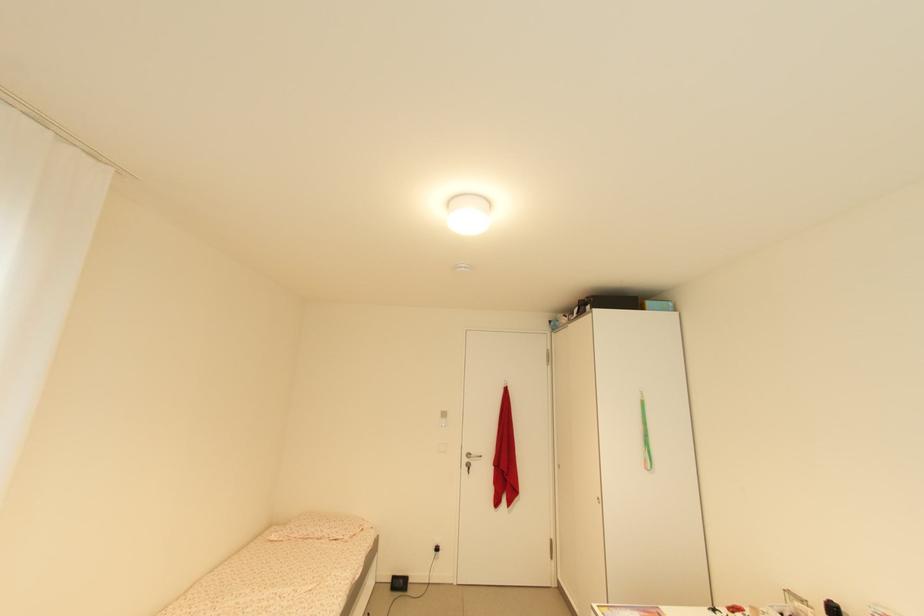
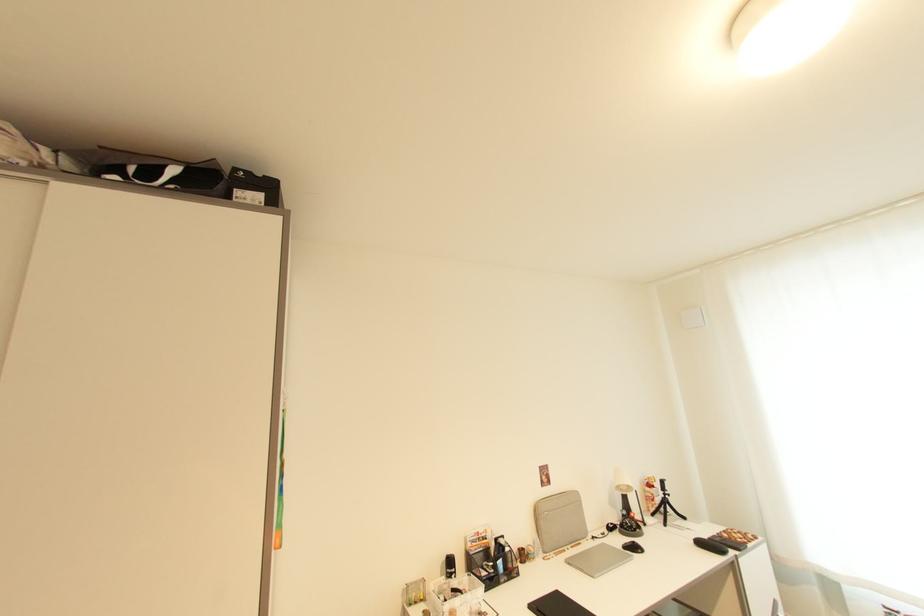
The point at [593,307] is marked in the first image. Where is the corresponding point in the second image?

(264, 198)